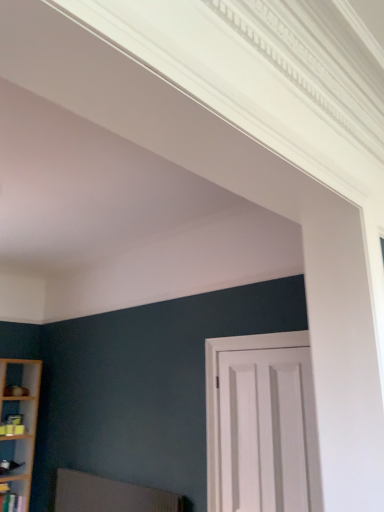
Question: From the image's perspective, is textured fabric swivel chair at lower left located beneath wooden shelf at lower left?

Choices:
 (A) yes
 (B) no

Answer: (B)

Question: Is textured fabric swivel chair at lower left touching wooden shelf at lower left?

Choices:
 (A) yes
 (B) no

Answer: (B)

Question: Would you say textured fabric swivel chair at lower left contains wooden shelf at lower left?

Choices:
 (A) yes
 (B) no

Answer: (B)

Question: Is the depth of textured fabric swivel chair at lower left greater than that of wooden shelf at lower left?

Choices:
 (A) no
 (B) yes

Answer: (A)

Question: From the image's perspective, does textured fabric swivel chair at lower left appear higher than wooden shelf at lower left?

Choices:
 (A) yes
 (B) no

Answer: (A)

Question: Does textured fabric swivel chair at lower left have a greater width compared to wooden shelf at lower left?

Choices:
 (A) no
 (B) yes

Answer: (A)

Question: Considering the relative positions of white matte door at center and wooden shelf at lower left in the image provided, is white matte door at center to the left of wooden shelf at lower left from the viewer's perspective?

Choices:
 (A) yes
 (B) no

Answer: (B)

Question: From a real-world perspective, is white matte door at center on wooden shelf at lower left?

Choices:
 (A) yes
 (B) no

Answer: (A)

Question: Is white matte door at center not close to wooden shelf at lower left?

Choices:
 (A) yes
 (B) no

Answer: (A)

Question: Considering the relative sizes of white matte door at center and wooden shelf at lower left in the image provided, is white matte door at center thinner than wooden shelf at lower left?

Choices:
 (A) no
 (B) yes

Answer: (B)

Question: Is wooden shelf at lower left at the back of white matte door at center?

Choices:
 (A) no
 (B) yes

Answer: (A)

Question: Is white matte door at center beside wooden shelf at lower left?

Choices:
 (A) yes
 (B) no

Answer: (B)

Question: Is white matte door at center closer to the viewer compared to textured fabric swivel chair at lower left?

Choices:
 (A) yes
 (B) no

Answer: (A)